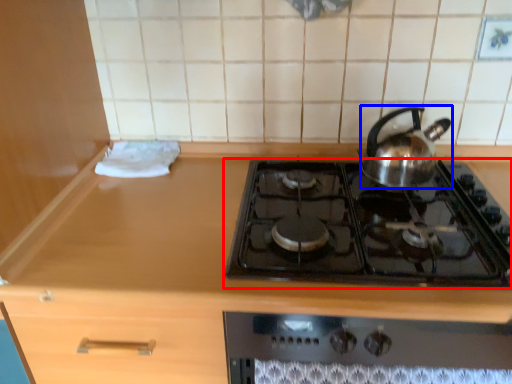
Question: Which object appears closest to the camera in this image, gas stove (highlighted by a red box) or kettle (highlighted by a blue box)?

Choices:
 (A) gas stove
 (B) kettle

Answer: (A)